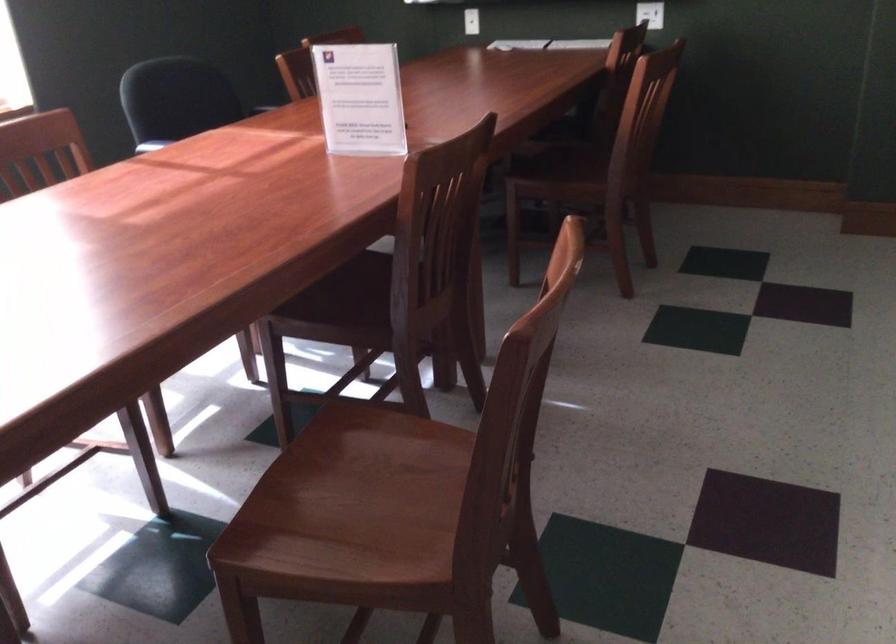
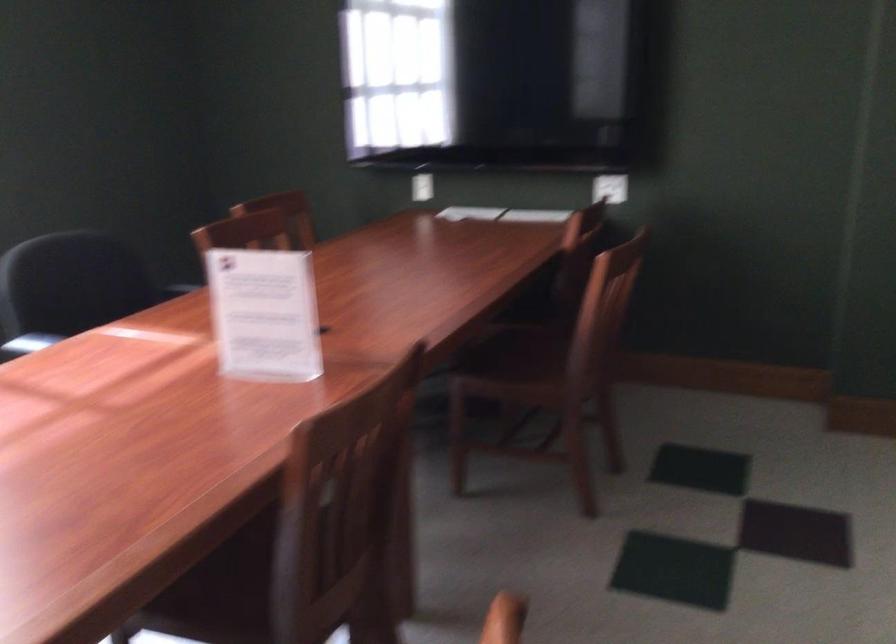
Question: Based on the continuous images, in which direction is the camera rotating? Reply with the corresponding letter.

Choices:
 (A) Left
 (B) Right
 (C) Up
 (D) Down

Answer: (C)